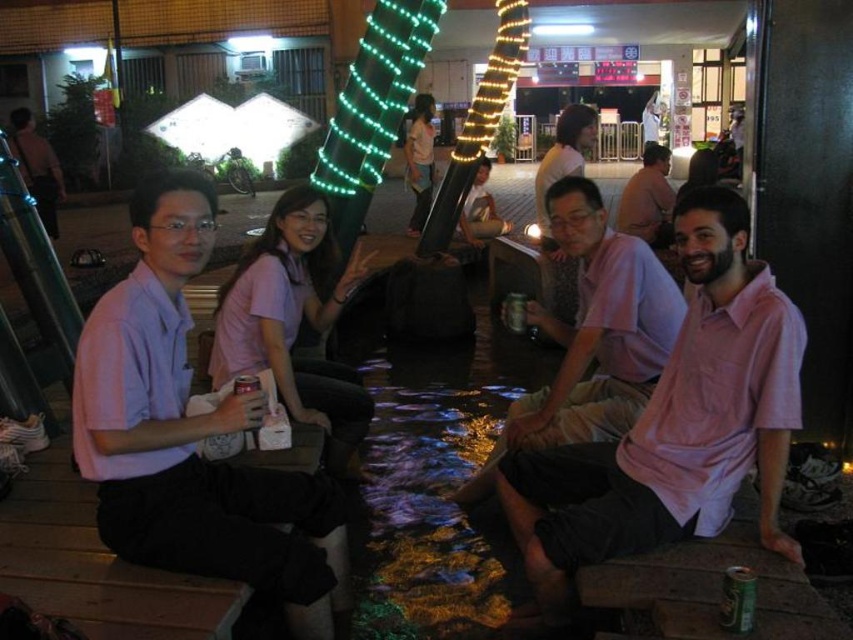
Which is below, pink cotton shirt at center or white matte can at center?

pink cotton shirt at center is below.

This screenshot has width=853, height=640. Identify the location of pink cotton shirt at center. (674, 424).

Describe the element at coordinates (674, 424) in the screenshot. I see `pink cotton shirt at center` at that location.

This screenshot has width=853, height=640. In order to click on pink cotton shirt at center in this screenshot , I will do `click(674, 424)`.

Does matte pink shirt at left have a smaller size compared to pink cotton shirt at center?

Actually, matte pink shirt at left might be larger than pink cotton shirt at center.

Which is in front, point (126, 346) or point (663, 470)?

Positioned in front is point (126, 346).

I want to click on matte pink shirt at left, so click(x=190, y=433).

Does point (573, 397) lie behind point (248, 388)?

Yes, point (573, 397) is behind point (248, 388).

Identify the location of matte pink shirt at center. The height and width of the screenshot is (640, 853). (592, 336).